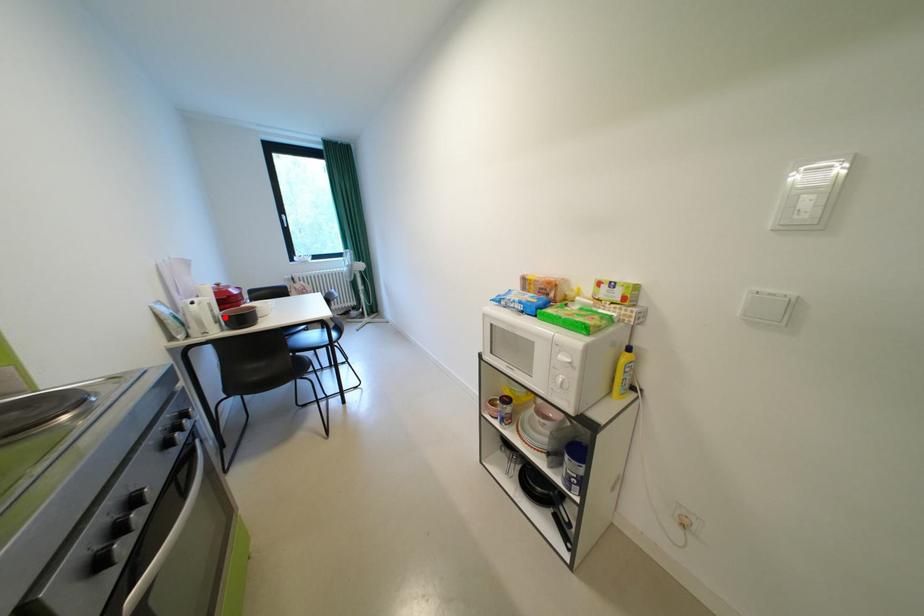
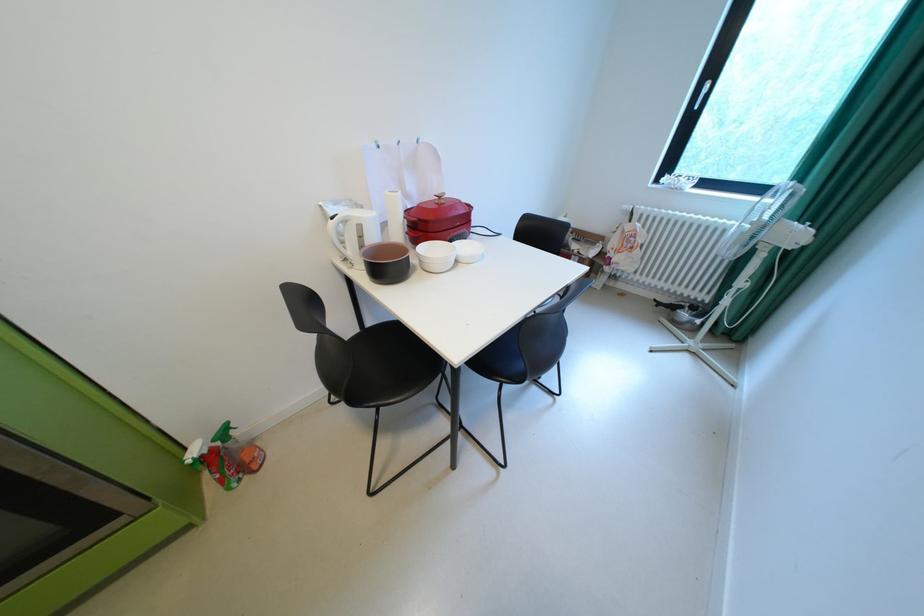
The point at the highlighted location is marked in the first image. Where is the corresponding point in the second image?

(371, 246)